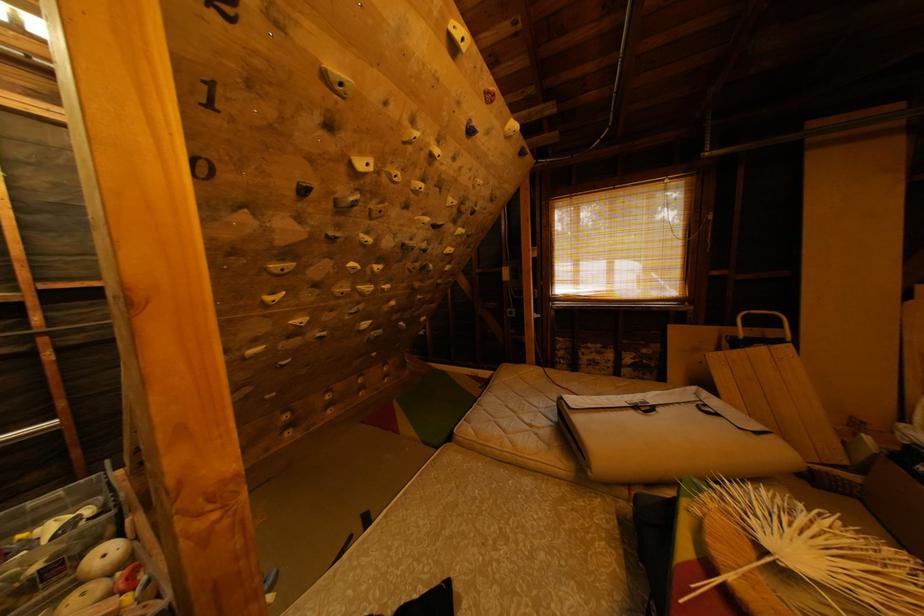
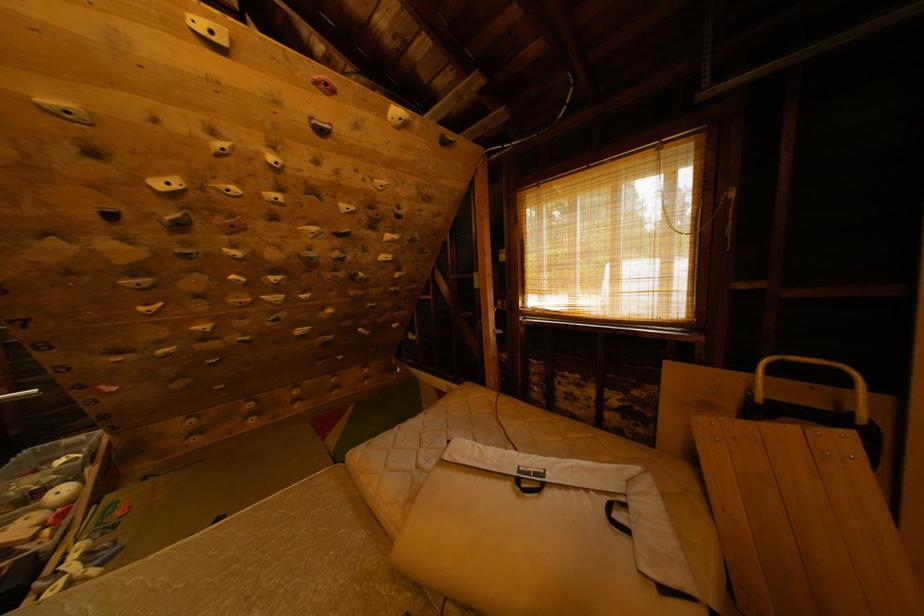
The images are taken continuously from a first-person perspective. In which direction are you moving?

The cameraman moved toward right, forward.